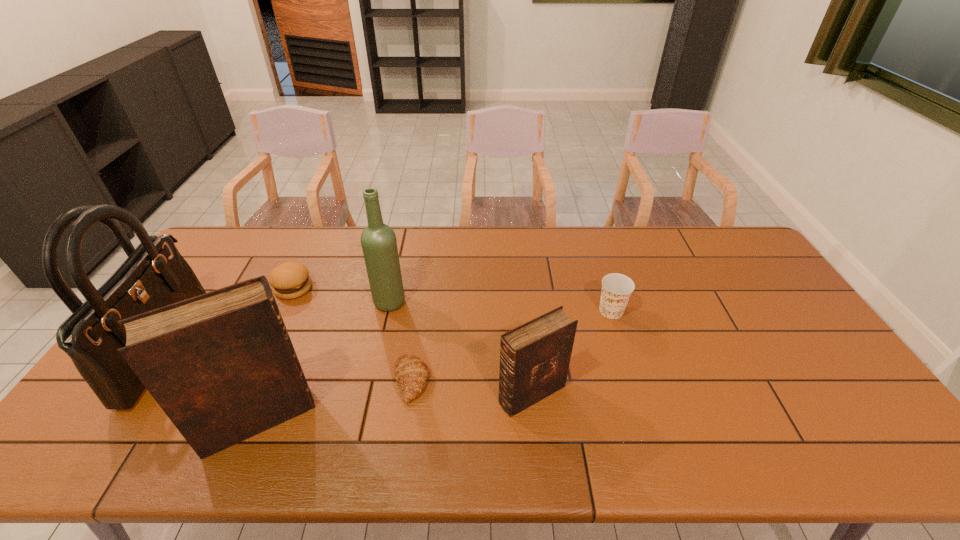
This screenshot has height=540, width=960. In order to click on the left Bible in this screenshot , I will do `click(221, 365)`.

Find the location of `the fourth tallest object`. the fourth tallest object is located at coordinates (534, 358).

I want to click on the shorter Bible, so click(534, 358).

Locate an element on the screen. This screenshot has width=960, height=540. hamburger is located at coordinates (290, 280).

Identify the location of the fifth tallest object. (617, 288).

Where is `Dixie cup`? Dixie cup is located at coordinates (617, 288).

Identify the location of the fourth object from left to right. Image resolution: width=960 pixels, height=540 pixels. (378, 240).

The image size is (960, 540). Identify the location of handbag. (154, 275).

Where is `crescent roll`? crescent roll is located at coordinates (411, 373).

You are a GUI agent. You are given a task and a screenshot of the screen. Output one action in this format:
    pyautogui.click(x=<x>, y=<y>)
    Task: Click on the fifth object from left to right
    The height and width of the screenshot is (540, 960).
    Given the screenshot: What is the action you would take?
    pyautogui.click(x=411, y=373)